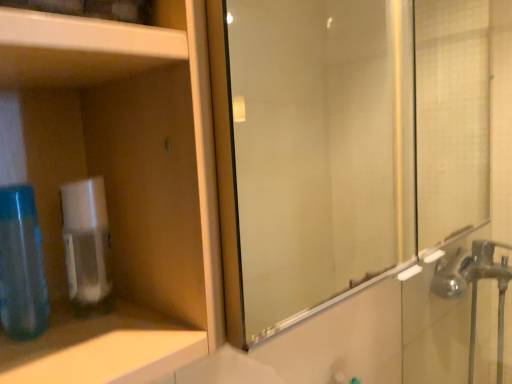
Question: From a real-world perspective, is silver metallic faucet at right physically located above or below matte plastic cabinet at left?

Choices:
 (A) below
 (B) above

Answer: (A)

Question: Is silver metallic faucet at right spatially inside matte plastic cabinet at left, or outside of it?

Choices:
 (A) inside
 (B) outside

Answer: (B)

Question: Which of these objects is positioned closest to the clear plastic soap dispenser at left?

Choices:
 (A) blue translucent bottle at left
 (B) matte plastic cabinet at left
 (C) silver metallic faucet at right
 (D) white glossy cabinet at upper left

Answer: (A)

Question: Estimate the real-world distances between objects in this image. Which object is closer to the white glossy cabinet at upper left?

Choices:
 (A) clear plastic soap dispenser at left
 (B) matte plastic cabinet at left
 (C) silver metallic faucet at right
 (D) blue translucent bottle at left

Answer: (B)